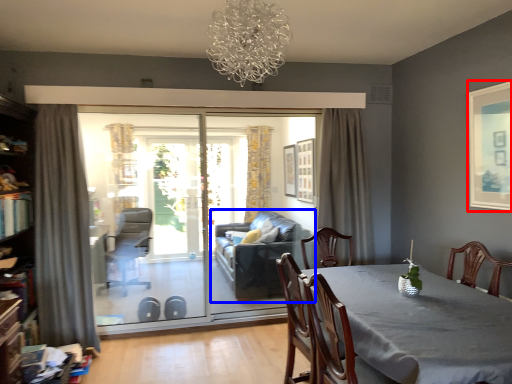
Question: Which object is closer to the camera taking this photo, picture frame (highlighted by a red box) or studio couch (highlighted by a blue box)?

Choices:
 (A) picture frame
 (B) studio couch

Answer: (A)